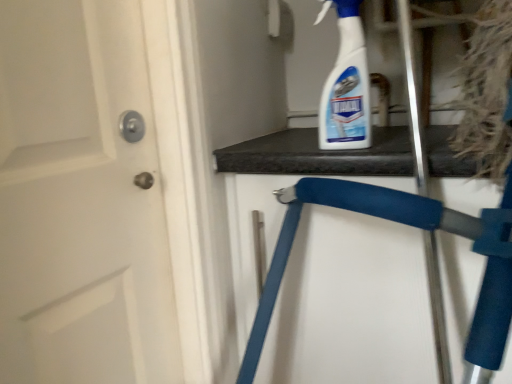
Question: From the image's perspective, is blue foam folding chair at upper center below white plastic spray bottle at upper right?

Choices:
 (A) no
 (B) yes

Answer: (B)

Question: Is blue foam folding chair at upper center behind white plastic spray bottle at upper right?

Choices:
 (A) yes
 (B) no

Answer: (B)

Question: From a real-world perspective, does blue foam folding chair at upper center stand above white plastic spray bottle at upper right?

Choices:
 (A) yes
 (B) no

Answer: (B)

Question: From the image's perspective, would you say blue foam folding chair at upper center is positioned over white plastic spray bottle at upper right?

Choices:
 (A) no
 (B) yes

Answer: (A)

Question: Considering the relative sizes of blue foam folding chair at upper center and white plastic spray bottle at upper right in the image provided, is blue foam folding chair at upper center thinner than white plastic spray bottle at upper right?

Choices:
 (A) no
 (B) yes

Answer: (A)

Question: Could you tell me if blue foam folding chair at upper center is facing white plastic spray bottle at upper right?

Choices:
 (A) yes
 (B) no

Answer: (B)

Question: Is white plastic spray bottle at upper right taller than blue foam folding chair at upper center?

Choices:
 (A) yes
 (B) no

Answer: (B)

Question: Are white plastic spray bottle at upper right and blue foam folding chair at upper center making contact?

Choices:
 (A) no
 (B) yes

Answer: (A)

Question: Is white plastic spray bottle at upper right in front of blue foam folding chair at upper center?

Choices:
 (A) yes
 (B) no

Answer: (B)

Question: From a real-world perspective, is white plastic spray bottle at upper right physically above blue foam folding chair at upper center?

Choices:
 (A) yes
 (B) no

Answer: (A)

Question: Does white plastic spray bottle at upper right have a larger size compared to blue foam folding chair at upper center?

Choices:
 (A) no
 (B) yes

Answer: (A)

Question: Could blue foam folding chair at upper center be considered to be inside white plastic spray bottle at upper right?

Choices:
 (A) no
 (B) yes

Answer: (A)

Question: From their relative heights in the image, would you say blue foam folding chair at upper center is taller or shorter than white plastic spray bottle at upper right?

Choices:
 (A) short
 (B) tall

Answer: (B)